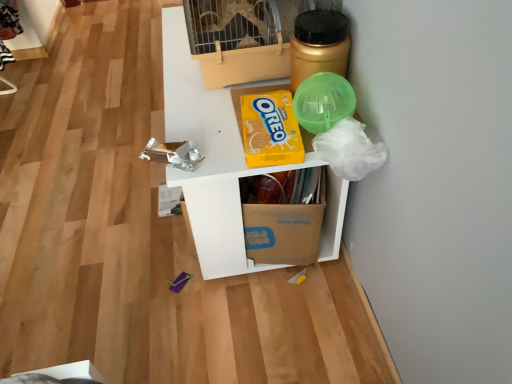
At what (x,y) coordinates should I click in order to perform the action: click on vacant region to the left of yellow cardboard oreo at upper center. Please return your answer as a coordinate pair (x, y). This screenshot has height=384, width=512. Looking at the image, I should click on (208, 127).